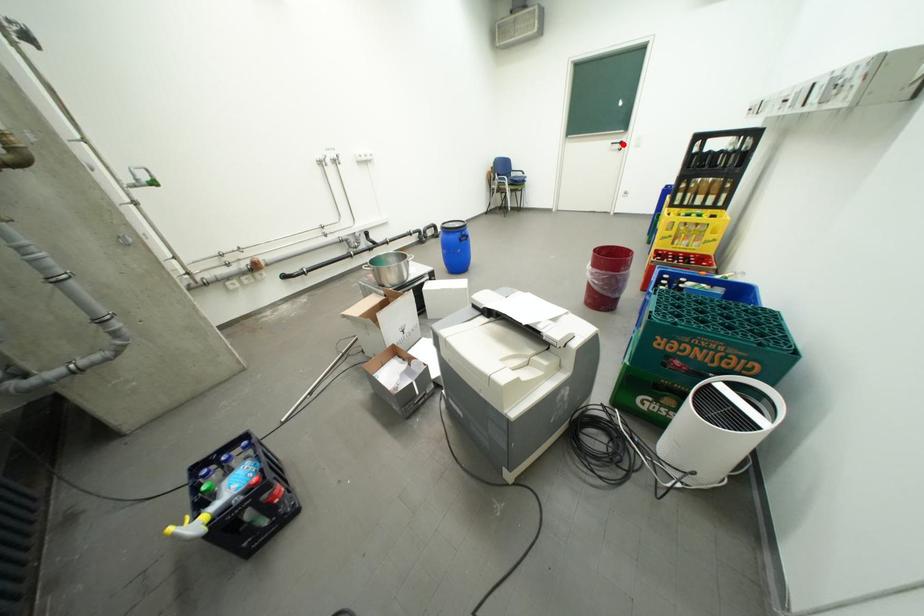
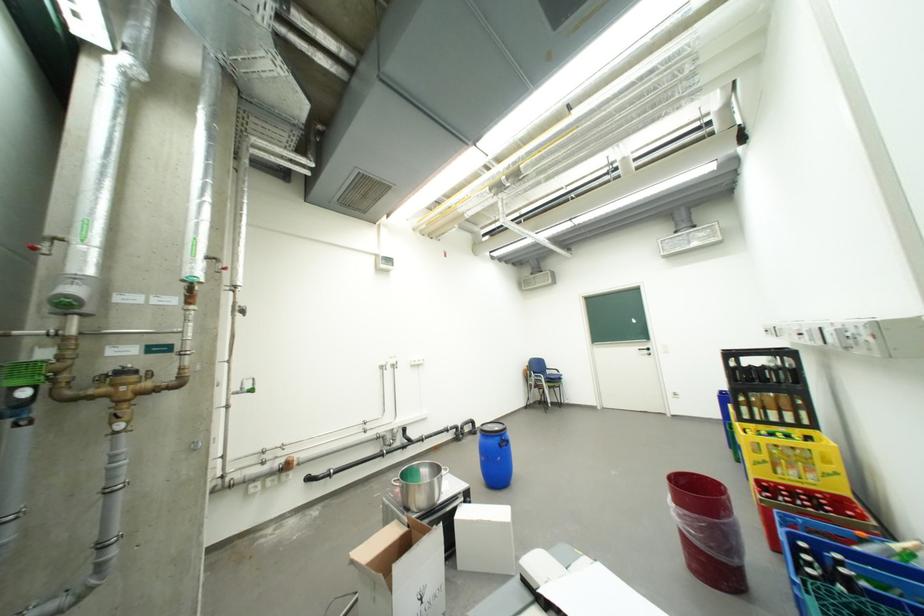
In the second image, find the point that corresponds to the highlighted location in the first image.

(650, 351)